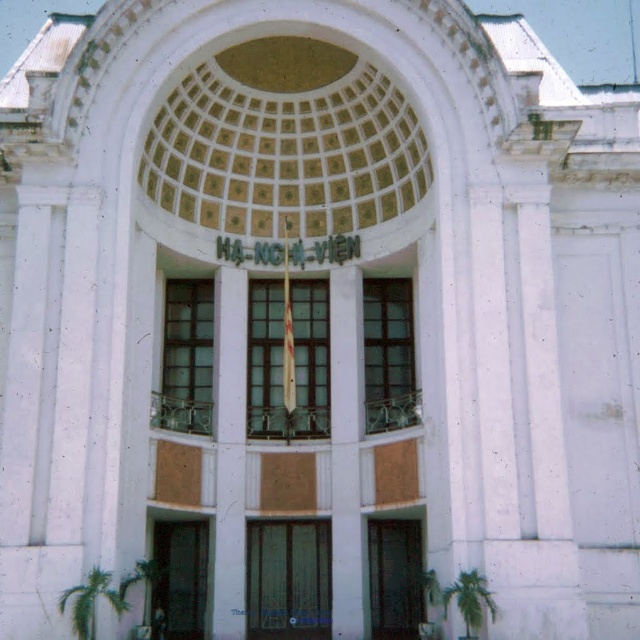
Question: Does green textured door at center appear on the right side of metallic glass door at lower center?

Choices:
 (A) yes
 (B) no

Answer: (B)

Question: Considering the relative positions of matte glass door at lower center and metallic glass door at lower center in the image provided, where is matte glass door at lower center located with respect to metallic glass door at lower center?

Choices:
 (A) above
 (B) below

Answer: (A)

Question: Which point is farther to the camera?

Choices:
 (A) green textured door at center
 (B) metallic glass door at lower center

Answer: (A)

Question: Is the position of green textured door at center less distant than that of metallic glass door at lower center?

Choices:
 (A) yes
 (B) no

Answer: (B)

Question: Which object appears farthest from the camera in this image?

Choices:
 (A) metallic glass door at lower center
 (B) green textured door at center

Answer: (B)

Question: Estimate the real-world distances between objects in this image. Which object is closer to the green textured door at center?

Choices:
 (A) matte glass door at lower center
 (B) metallic glass door at lower center

Answer: (B)